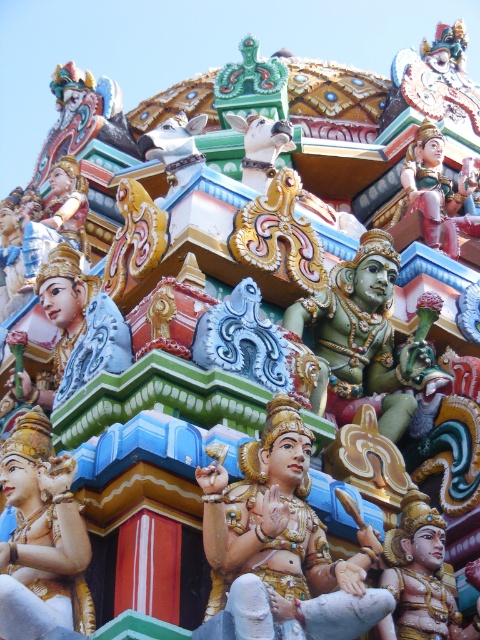
You are an architect designing a new temple and want to place a new statue in the same location as the polished gold statue at center. What are the coordinates where you should place it?

The polished gold statue at center is located at coordinates point (282, 544).

You are standing in front of the temple structure and want to move from point A to point B. If point A is at coordinate point (342, 330) and point B is at coordinate point (98, 364), which direction should you move to go from point A to point B?

To move from point A at coordinate point (342, 330) to point B at coordinate point (98, 364), you should move downward because point A is above point B.

You are standing in front of an ancient temple and want to take a photo of the gold polished statue at center. Considering you are 175.69 feet away from it, will you be able to capture the entire statue in your camera frame?

The gold polished statue at center is 175.69 feet away from you. Whether you can capture it fully depends on your camera lens. A standard lens might require moving closer, while a wide angle could include it from that distance. Adjust your equipment accordingly.